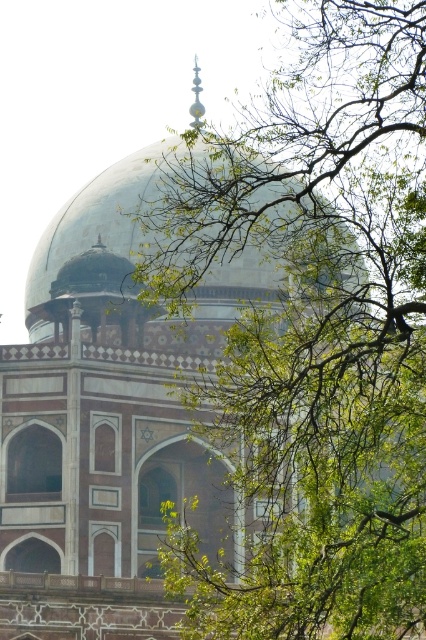
Between green leafy branches at upper center and green glass dome at center, which one appears on the right side from the viewer's perspective?

green leafy branches at upper center is more to the right.

Between green leafy branches at upper center and green glass dome at center, which one is positioned lower?

green leafy branches at upper center

Who is more forward, (422, 556) or (123, 209)?

Point (422, 556) is in front.

Where is `green leafy branches at upper center`? green leafy branches at upper center is located at coordinates (314, 330).